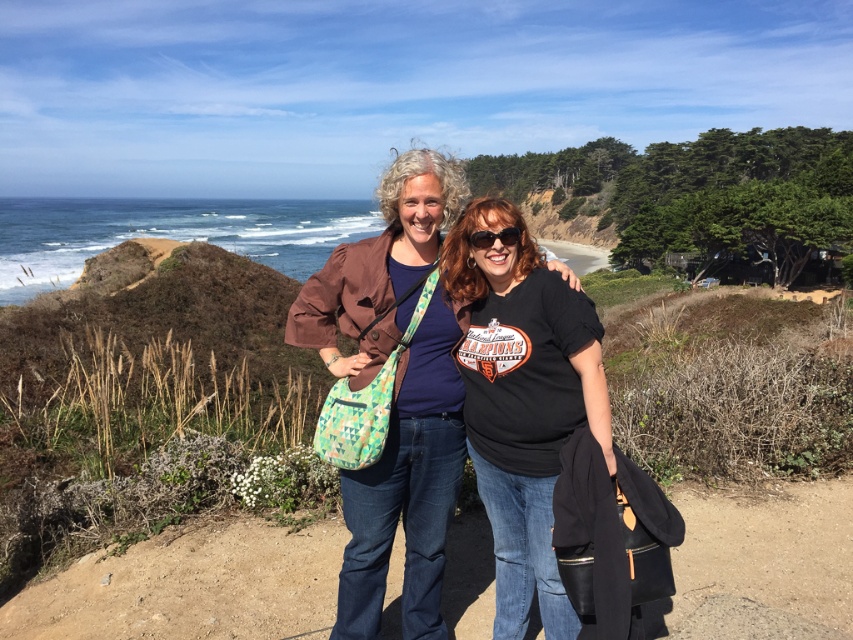
Can you confirm if matte brown jacket at center is wider than black plastic sunglasses at center?

Indeed, matte brown jacket at center has a greater width compared to black plastic sunglasses at center.

Which of these two, matte brown jacket at center or black plastic sunglasses at center, stands shorter?

black plastic sunglasses at center is shorter.

Locate an element on the screen. Image resolution: width=853 pixels, height=640 pixels. matte brown jacket at center is located at coordinates (408, 484).